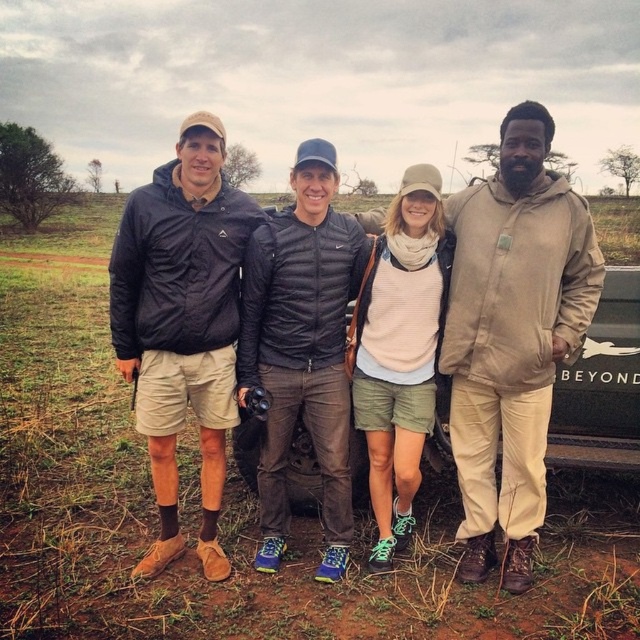
Question: Is black matte jacket at left wider than black quilted jacket at center?

Choices:
 (A) no
 (B) yes

Answer: (A)

Question: Among these points, which one is farthest from the camera?

Choices:
 (A) (515, 536)
 (B) (168, 563)
 (C) (419, 438)
 (D) (326, 497)

Answer: (D)

Question: Which of the following is the farthest from the observer?

Choices:
 (A) tan fabric jacket at right
 (B) matte black jacket at center
 (C) black quilted jacket at center
 (D) light pink sweater at center

Answer: (D)

Question: Is black quilted jacket at center closer to camera compared to light pink sweater at center?

Choices:
 (A) no
 (B) yes

Answer: (B)

Question: In this image, where is matte black jacket at center located relative to tan fabric jacket at right?

Choices:
 (A) above
 (B) below

Answer: (A)

Question: Which of the following is the closest to the observer?

Choices:
 (A) (339, 300)
 (B) (163, 332)
 (C) (385, 273)

Answer: (B)